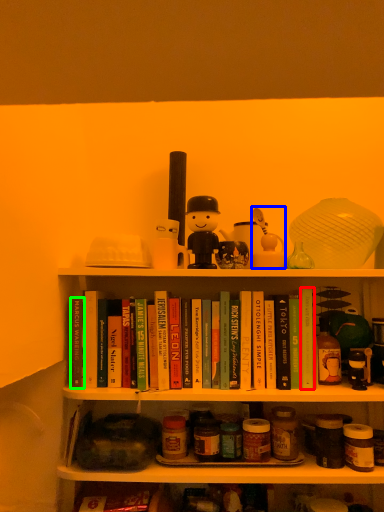
Question: Which is nearer to the paperback book (highlighted by a red box)? toy (highlighted by a blue box) or paperback book (highlighted by a green box).

Choices:
 (A) toy
 (B) paperback book

Answer: (A)